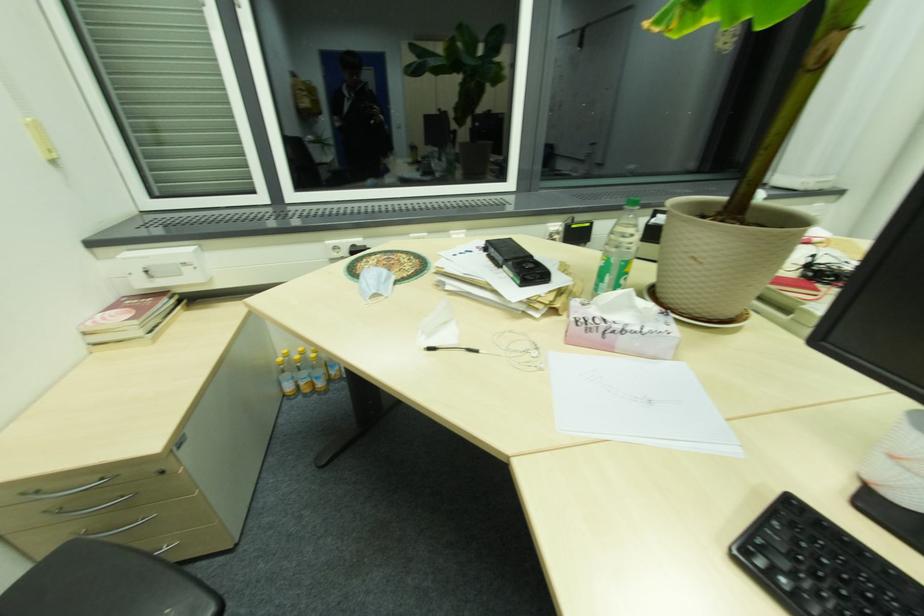
Where would you sit the chair sitting surface? Please return your answer as a coordinate pair (x, y).

(119, 583)